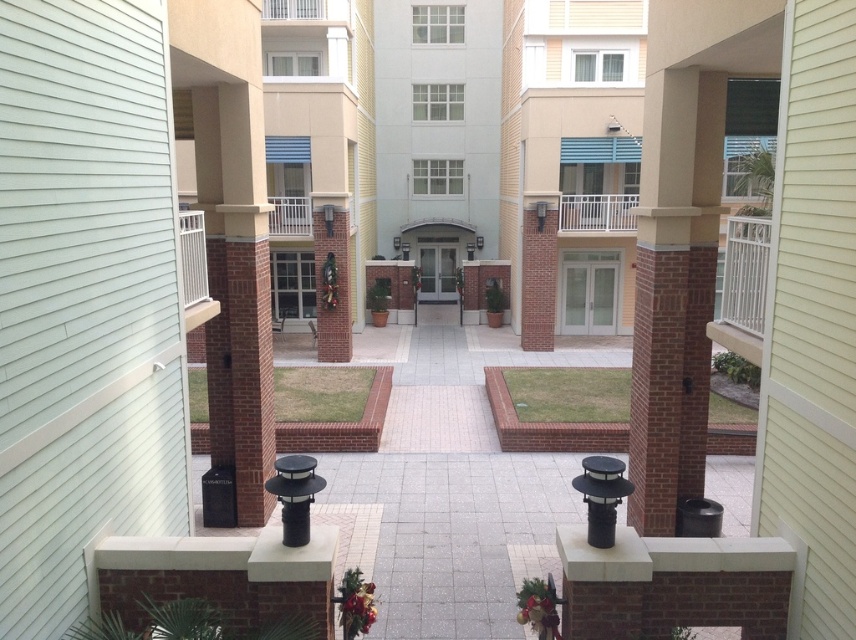
Who is shorter, white painted wood balcony at left or white metal balcony at upper center?

white metal balcony at upper center

What do you see at coordinates (194, 269) in the screenshot? The image size is (856, 640). I see `white painted wood balcony at left` at bounding box center [194, 269].

Identify the location of white painted wood balcony at left. This screenshot has height=640, width=856. (194, 269).

Is white metal railing at upper center positioned before white metal balcony at upper center?

No, white metal railing at upper center is behind white metal balcony at upper center.

Between white metal railing at upper center and white metal balcony at upper center, which one is positioned lower?

white metal balcony at upper center is below.

You are a GUI agent. You are given a task and a screenshot of the screen. Output one action in this format:
    pyautogui.click(x=<x>, y=<y>)
    Task: Click on the white metal railing at upper center
    
    Given the screenshot: What is the action you would take?
    597,212

Identify the location of white metal railing at upper center. The width and height of the screenshot is (856, 640). (597, 212).

Does white painted wood balcony at left lie in front of white metal railing at upper center?

That is True.

Identify the location of white painted wood balcony at left. (194, 269).

The image size is (856, 640). Identify the location of white painted wood balcony at left. (194, 269).